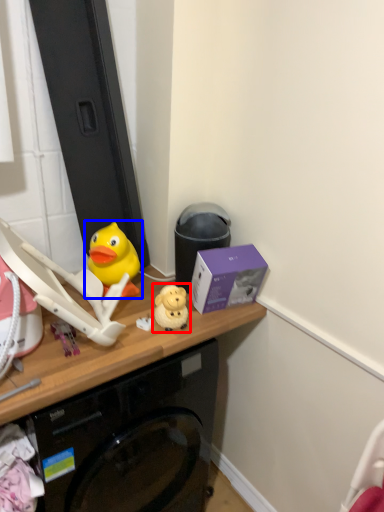
Question: Among these objects, which one is farthest to the camera, toy (highlighted by a red box) or toy (highlighted by a blue box)?

Choices:
 (A) toy
 (B) toy

Answer: (B)